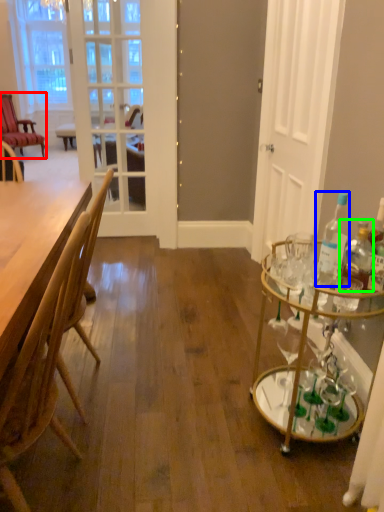
Question: Which object is the closest to the chair (highlighted by a red box)? Choose among these: bottle (highlighted by a blue box) or bottle (highlighted by a green box).

Choices:
 (A) bottle
 (B) bottle

Answer: (A)